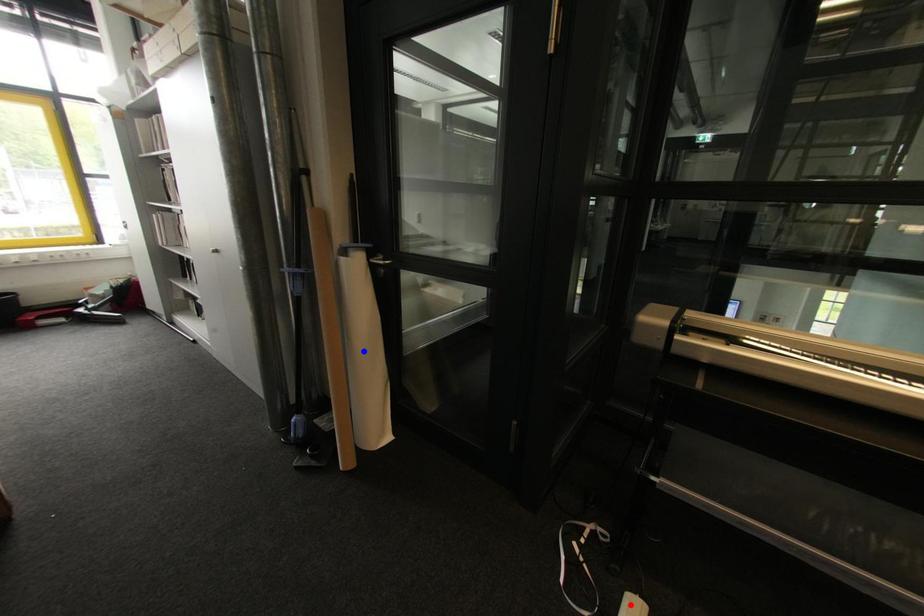
Question: Which of the two points in the image is closer to the camera?

Choices:
 (A) Blue point is closer.
 (B) Red point is closer.

Answer: (B)